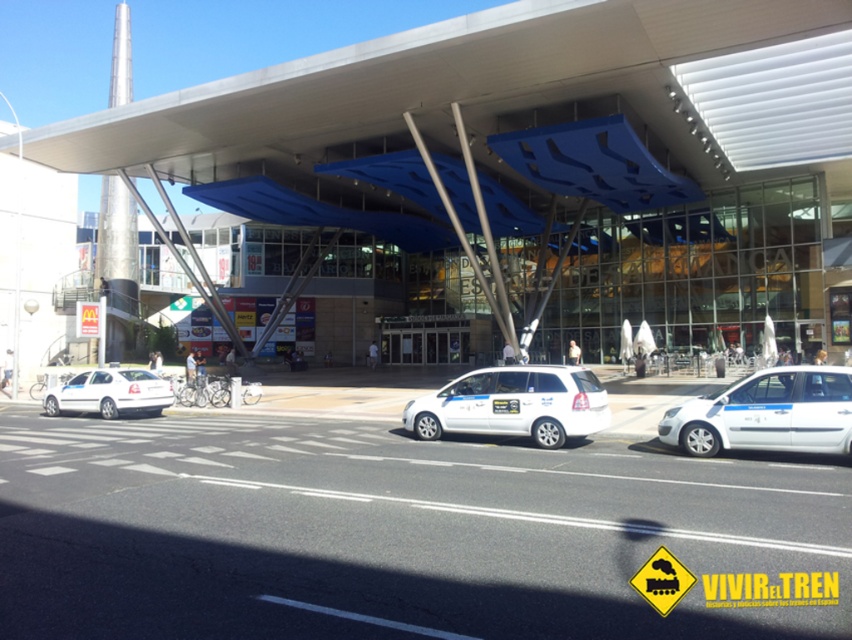
You are a delivery driver arriving at the location. You need to park your truck, which is 10 meters long, near the transparent glass building at center and the white matte van at center. Can you fit your truck between them?

The transparent glass building at center is larger in size than the white matte van at center, but the distance between them isn not specified in the objects description. Therefore, it is unclear if the truck can fit between them.

From the picture: You are a delivery driver who needs to park your van in the parking lot near the building. The parking space at the right can only accommodate vehicles up to the size of the white matte van at center. Can your van, which is the same size as the white matte van at right, fit into that parking space?

The white matte van at right is larger in size than the white matte van at center. Since your van is the same size as the larger van, it would exceed the parking space capacity, so it cannot fit into the parking space at the right.

You are a delivery driver needing to park your truck between the two white matte vans. The truck requires 18 feet of space. Can you fit your truck between the white matte van at right and the white matte van at center?

The distance between the white matte van at right and the white matte van at center is 15.90 feet, which is less than the required 18 feet. Therefore, the truck cannot fit between them.